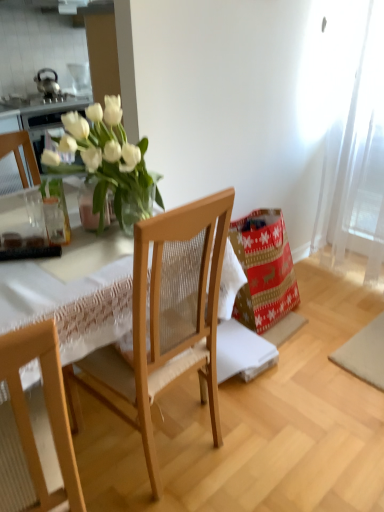
Question: Is red and gold paper bag at lower right not near clear glass vase at left?

Choices:
 (A) no
 (B) yes

Answer: (A)

Question: Is red and gold paper bag at lower right closer to the viewer compared to clear glass vase at left?

Choices:
 (A) yes
 (B) no

Answer: (B)

Question: Could you tell me if red and gold paper bag at lower right is turned towards clear glass vase at left?

Choices:
 (A) yes
 (B) no

Answer: (B)

Question: From a real-world perspective, is red and gold paper bag at lower right located higher than clear glass vase at left?

Choices:
 (A) yes
 (B) no

Answer: (B)

Question: Does red and gold paper bag at lower right have a lesser width compared to clear glass vase at left?

Choices:
 (A) yes
 (B) no

Answer: (B)

Question: From the image's perspective, is red and gold paper bag at lower right beneath clear glass vase at left?

Choices:
 (A) no
 (B) yes

Answer: (B)

Question: From the image's perspective, is clear glass vase at left on white sheer curtain at right?

Choices:
 (A) no
 (B) yes

Answer: (A)

Question: Is clear glass vase at left surrounding white sheer curtain at right?

Choices:
 (A) yes
 (B) no

Answer: (B)

Question: Is clear glass vase at left oriented away from white sheer curtain at right?

Choices:
 (A) yes
 (B) no

Answer: (B)

Question: Is clear glass vase at left smaller than white sheer curtain at right?

Choices:
 (A) no
 (B) yes

Answer: (B)

Question: Considering the relative sizes of clear glass vase at left and white sheer curtain at right in the image provided, is clear glass vase at left wider than white sheer curtain at right?

Choices:
 (A) yes
 (B) no

Answer: (B)

Question: Considering the relative sizes of clear glass vase at left and white sheer curtain at right in the image provided, is clear glass vase at left shorter than white sheer curtain at right?

Choices:
 (A) no
 (B) yes

Answer: (B)

Question: Can you see clear glass vase at left touching wooden chair at center?

Choices:
 (A) no
 (B) yes

Answer: (A)